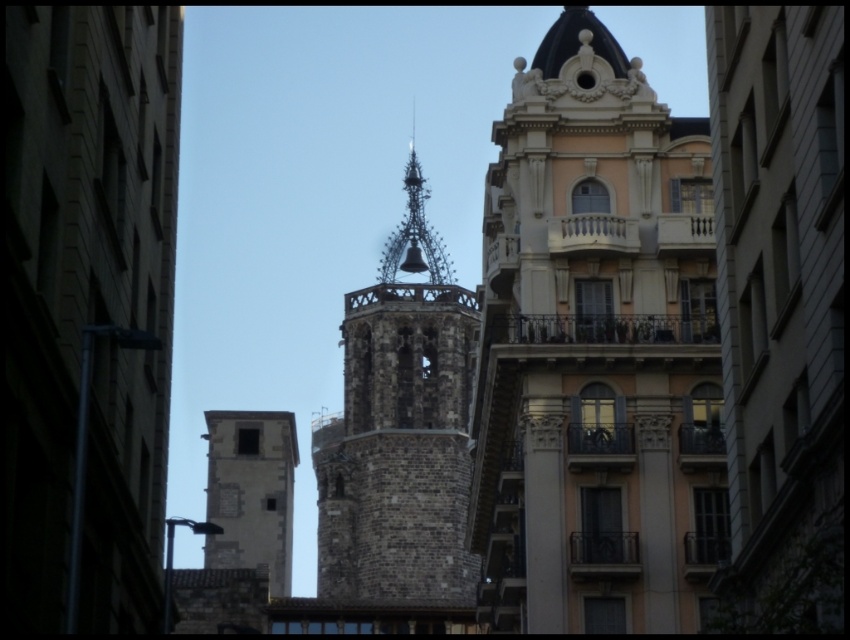
Question: Considering the real-world distances, which object is farthest from the brick tower at center?

Choices:
 (A) brown stone tower at center
 (B) beige stone building at center

Answer: (B)

Question: From the image, what is the correct spatial relationship of beige stone building at center in relation to dark brown stone spire at center?

Choices:
 (A) below
 (B) above

Answer: (A)

Question: Which object is positioned farthest from the brown stone tower at center?

Choices:
 (A) dark brown stone spire at center
 (B) beige stone building at center

Answer: (B)

Question: Which point is farther to the camera?

Choices:
 (A) (411, 266)
 (B) (547, 182)
 (C) (349, 484)
 (D) (269, 580)

Answer: (A)

Question: Is beige stone building at center wider than brick tower at center?

Choices:
 (A) yes
 (B) no

Answer: (B)

Question: In this image, where is brick tower at center located relative to brown stone tower at center?

Choices:
 (A) right
 (B) left

Answer: (A)